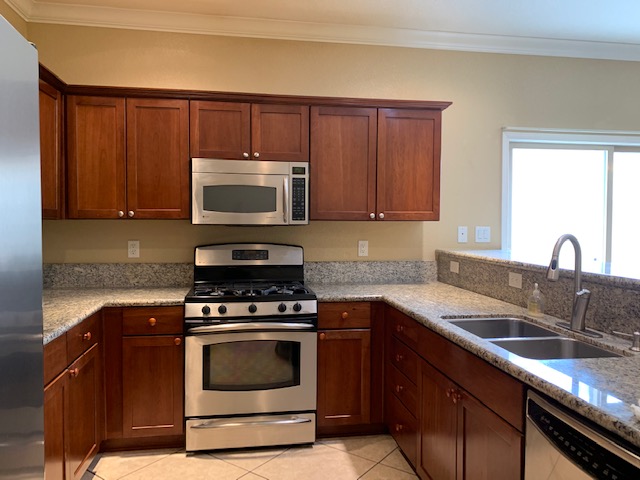
The height and width of the screenshot is (480, 640). Find the location of `upper cabinet doors`. upper cabinet doors is located at coordinates (411, 174), (346, 166), (285, 134), (224, 128), (164, 142), (89, 157).